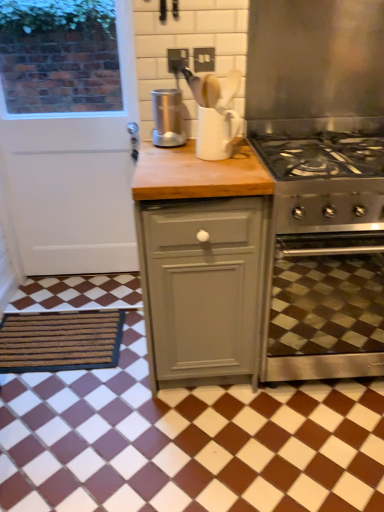
You are a GUI agent. You are given a task and a screenshot of the screen. Output one action in this format:
    pyautogui.click(x=<x>, y=<y>)
    Task: Click on the free point above matte gray cabinet at center (from a real-world perspective)
    The image size is (384, 512).
    Given the screenshot: What is the action you would take?
    pyautogui.click(x=193, y=160)